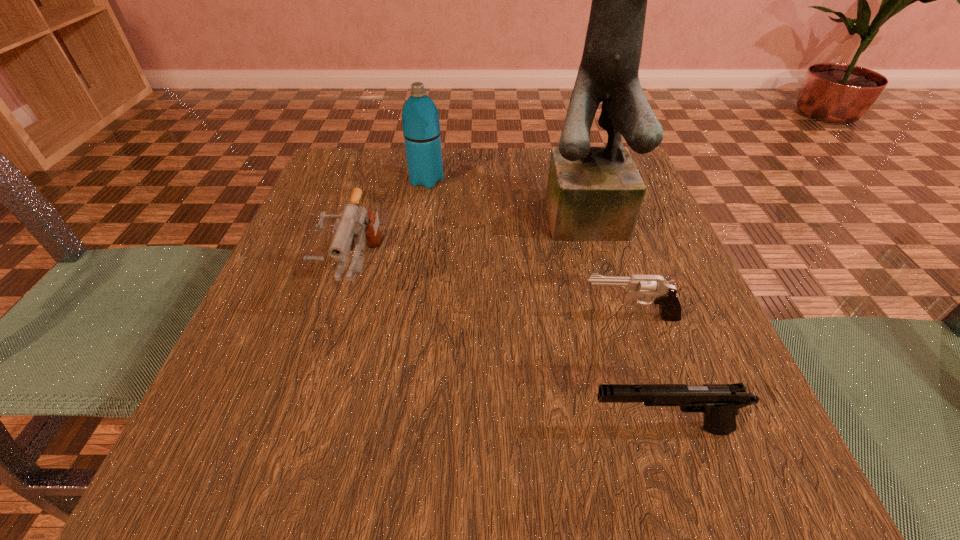
Identify which object is located as the nearest to the nearest object. Please provide its 2D coordinates. Your answer should be formatted as a tuple, i.e. [(x, y)], where the tuple contains the x and y coordinates of a point satisfying the conditions above.

[(663, 293)]

I want to click on gun that is the second closest one to the third tallest object, so click(x=719, y=402).

Identify which gun is the closest to the nearest object. Please provide its 2D coordinates. Your answer should be formatted as a tuple, i.e. [(x, y)], where the tuple contains the x and y coordinates of a point satisfying the conditions above.

[(663, 293)]